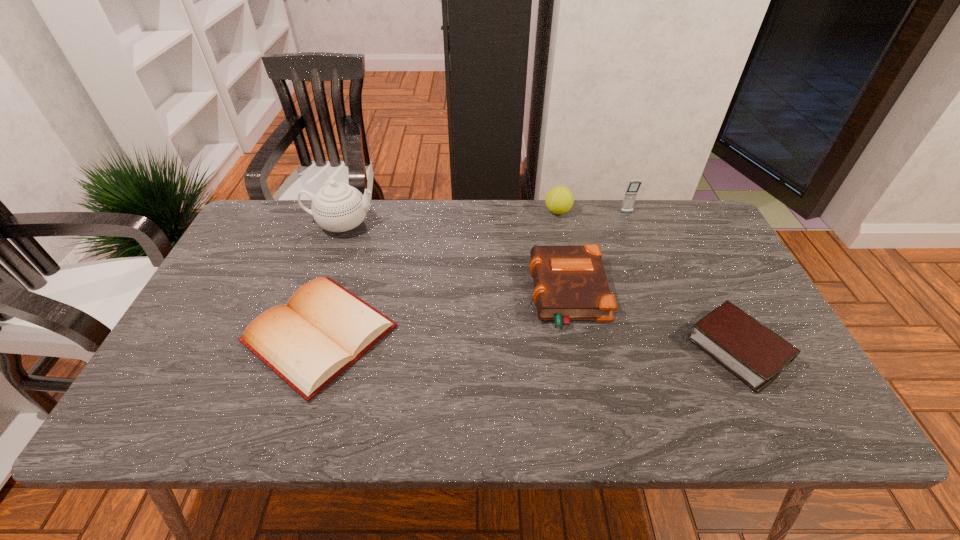
Find the location of a particular element. The height and width of the screenshot is (540, 960). tennis ball present at the far edge is located at coordinates (559, 199).

Where is `object that is at the near edge`? Image resolution: width=960 pixels, height=540 pixels. object that is at the near edge is located at coordinates (324, 328).

I want to click on object that is at the left edge, so click(x=324, y=328).

Identify the location of object at the right edge. (748, 349).

This screenshot has width=960, height=540. I want to click on object that is at the near left corner, so click(x=324, y=328).

I want to click on free region at the far edge of the desktop, so click(629, 236).

Image resolution: width=960 pixels, height=540 pixels. What are the coordinates of `vacant space at the near edge of the desktop` in the screenshot? It's located at (274, 406).

Locate an element on the screen. The image size is (960, 540). free space at the left edge of the desktop is located at coordinates (199, 320).

In order to click on vacant point at the far left corner in this screenshot , I will do `click(266, 210)`.

Image resolution: width=960 pixels, height=540 pixels. In order to click on free point at the near left corner in this screenshot , I will do `click(151, 429)`.